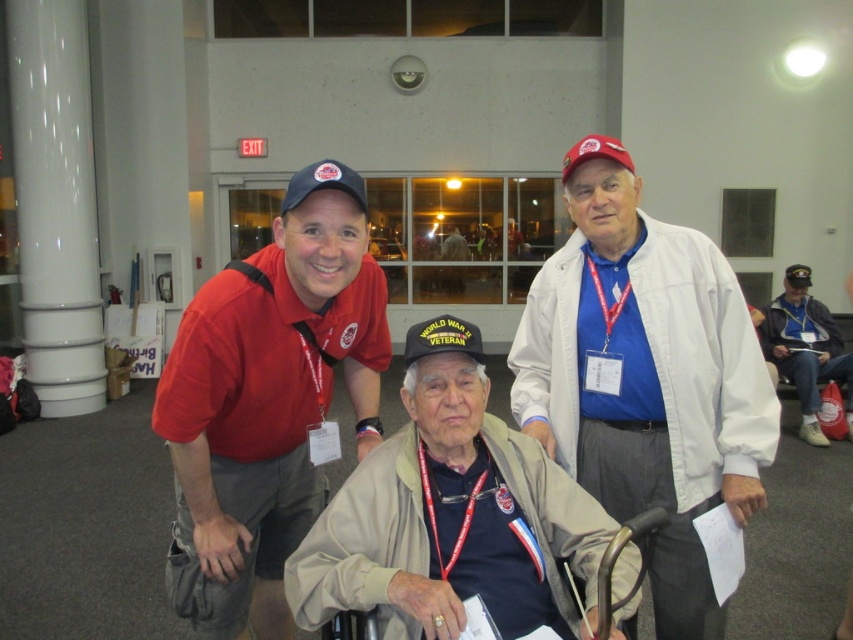
You are a photographer at the event and need to take a photo of both the matte red shirt at left and the beige fabric wheelchair at center. Based on their heights, which object should you focus on first to ensure both are in frame?

The matte red shirt at left is much taller than the beige fabric wheelchair at center, so focus on the matte red shirt at left first to ensure both are in frame.